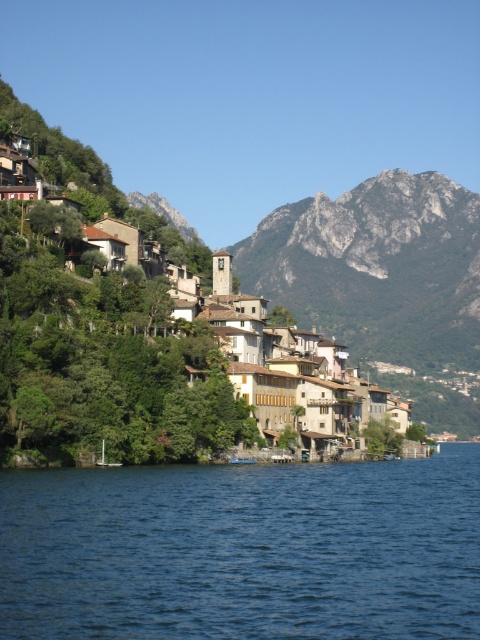
Question: Can you confirm if blue liquid water at lower center is positioned to the right of brown wooden houses at center?

Choices:
 (A) no
 (B) yes

Answer: (B)

Question: Which point is closer to the camera?

Choices:
 (A) (39, 362)
 (B) (464, 404)
 (C) (20, 572)

Answer: (C)

Question: Where is brown wooden houses at center located in relation to rugged stone mountain at upper center in the image?

Choices:
 (A) right
 (B) left

Answer: (B)

Question: Can you confirm if brown wooden houses at center is smaller than rugged stone mountain at upper center?

Choices:
 (A) no
 (B) yes

Answer: (B)

Question: Among these objects, which one is nearest to the camera?

Choices:
 (A) brown wooden houses at center
 (B) blue liquid water at lower center

Answer: (B)

Question: Which object is farther from the camera taking this photo?

Choices:
 (A) brown wooden houses at center
 (B) rugged stone mountain at upper center

Answer: (B)